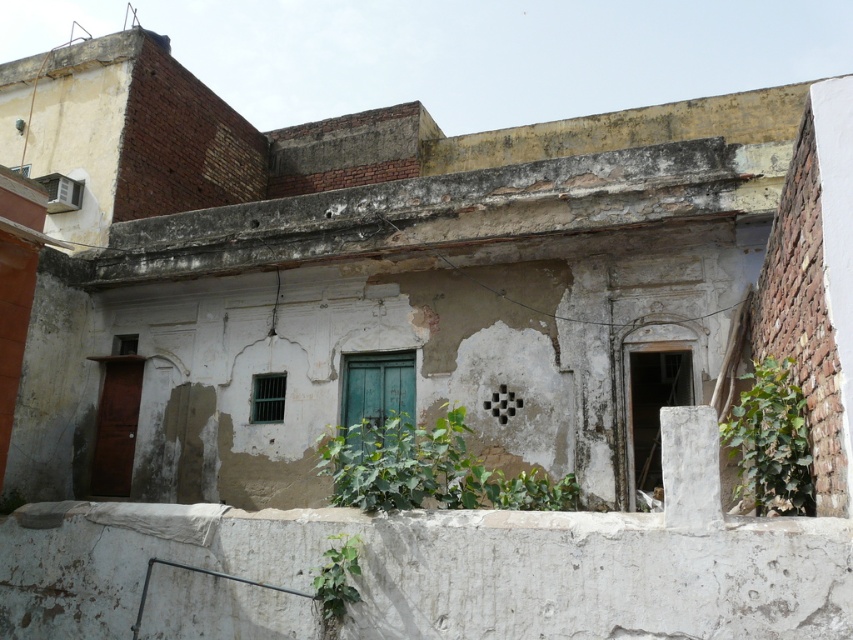
You are a gardener tasked with watering two green leafy plants in the scene. The plants are the green leafy plant at center and the green leafy plant at lower center. Which plant requires more water based on their sizes?

The green leafy plant at center might be wider than green leafy plant at lower center, so it likely requires more water as larger plants typically need more water to maintain their growth.

You are standing in front of the old building and notice two points marked on its facade. The first point is at coordinate point (512, 496) and the second is at point (764, 476). Which point is closer to you?

Point (764, 476) is closer to you because it is in front of point (512, 496).